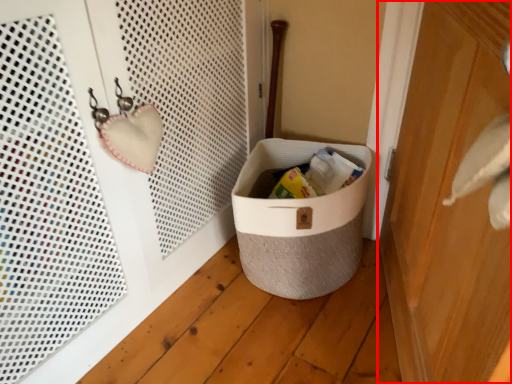
Question: Where is door (annotated by the red box) located in relation to storage box in the image?

Choices:
 (A) right
 (B) left

Answer: (A)